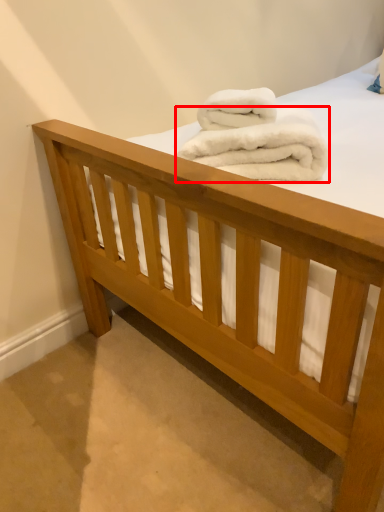
Question: From the image's perspective, where is towel (annotated by the red box) located relative to towel?

Choices:
 (A) above
 (B) below

Answer: (B)